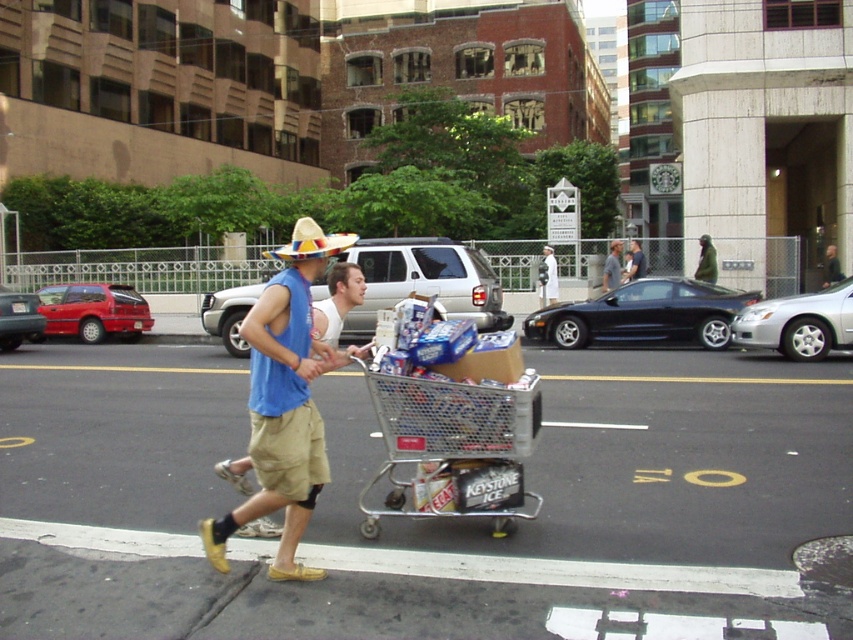
Does multicolored woven straw hat at center appear on the right side of blue t-shirt at center?

Incorrect, multicolored woven straw hat at center is not on the right side of blue t-shirt at center.

Between multicolored woven straw hat at center and blue t-shirt at center, which one has less height?

Standing shorter between the two is blue t-shirt at center.

Which is in front, point (300, 220) or point (614, 276)?

Point (300, 220) is more forward.

Identify the location of multicolored woven straw hat at center. (311, 243).

Which of these two, khaki shorts at center or blue t-shirt at center, stands taller?

khaki shorts at center is taller.

Between khaki shorts at center and blue t-shirt at center, which one is positioned higher?

blue t-shirt at center is higher up.

This screenshot has width=853, height=640. What are the coordinates of `khaki shorts at center` in the screenshot? It's located at (283, 403).

Which is in front, point (270, 337) or point (714, 256)?

Point (270, 337)

Between khaki shorts at center and green fuzzy jacket at center, which one is positioned higher?

green fuzzy jacket at center is higher up.

Based on the photo, who is more forward, (254, 390) or (700, 253)?

Positioned in front is point (254, 390).

Image resolution: width=853 pixels, height=640 pixels. In order to click on khaki shorts at center in this screenshot , I will do `click(283, 403)`.